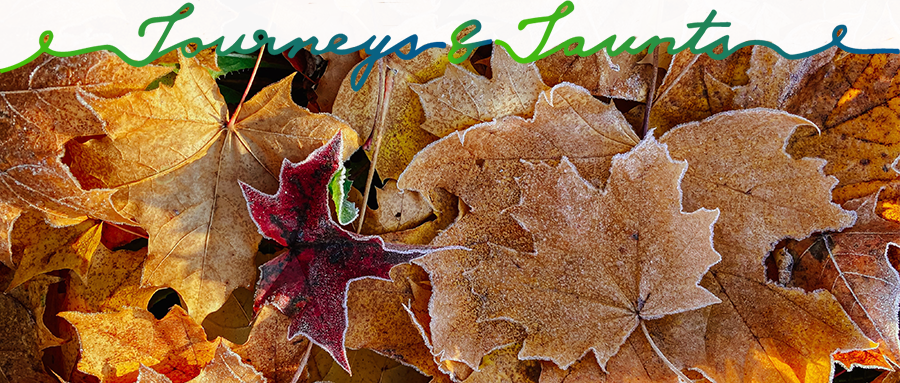
The width and height of the screenshot is (900, 383). In order to click on artwork in this screenshot , I will do `click(508, 125)`.